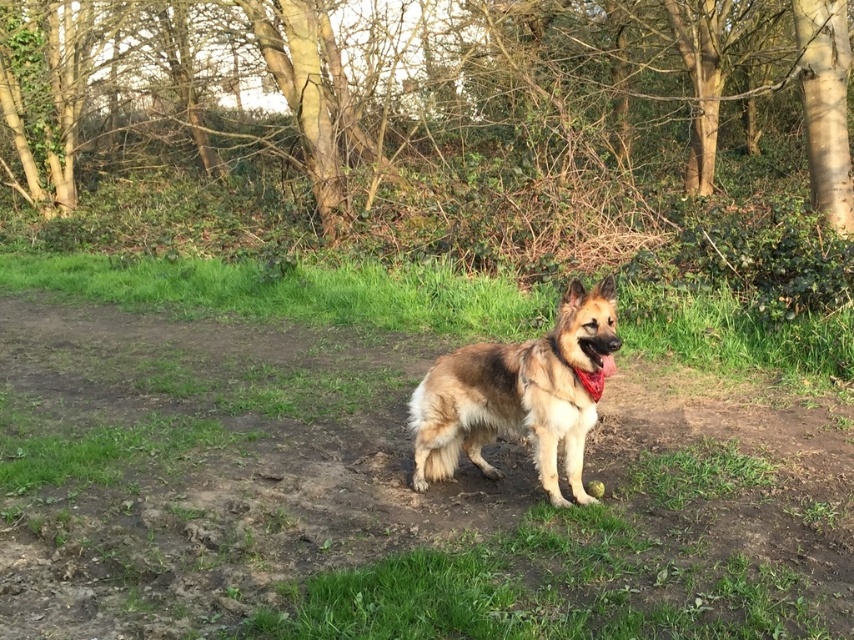
Consider the image. Is brown fur dog at center to the right of red fabric neckband at center from the viewer's perspective?

In fact, brown fur dog at center is to the left of red fabric neckband at center.

Does point (563, 300) lie behind point (583, 380)?

Yes, it is.

You are a GUI agent. You are given a task and a screenshot of the screen. Output one action in this format:
    pyautogui.click(x=<x>, y=<y>)
    Task: Click on the brown fur dog at center
    
    Given the screenshot: What is the action you would take?
    pyautogui.click(x=519, y=396)

Is brown bark tree at center wider than brown fur dog at center?

Indeed, brown bark tree at center has a greater width compared to brown fur dog at center.

Who is higher up, brown bark tree at center or brown fur dog at center?

brown bark tree at center is higher up.

This screenshot has width=854, height=640. What are the coordinates of `brown bark tree at center` in the screenshot? It's located at (430, 99).

Where is `brown bark tree at center`? The image size is (854, 640). brown bark tree at center is located at coordinates (430, 99).

Is green grass at center taller than brown fur dog at center?

Yes.

Is point (379, 308) closer to camera compared to point (554, 328)?

No, (379, 308) is behind (554, 328).

At what (x,y) coordinates should I click in order to perform the action: click on green grass at center. Please return your answer as a coordinate pair (x, y). The width and height of the screenshot is (854, 640). Looking at the image, I should click on [x=291, y=291].